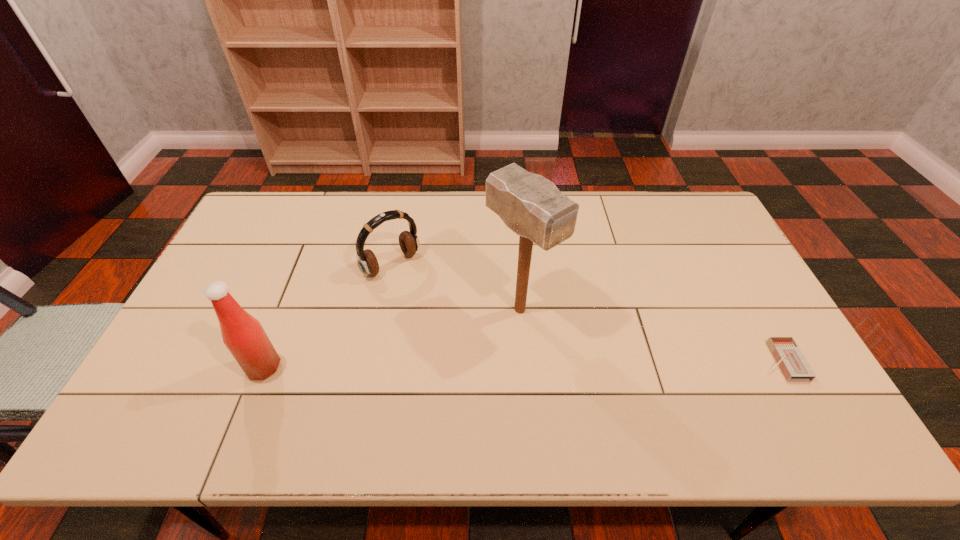
The image size is (960, 540). I want to click on the closest object relative to the third object from left to right, so click(x=367, y=262).

The image size is (960, 540). I want to click on blank space that satisfies the following two spatial constraints: 1. on the front side of the rightmost object; 2. on the striking surface of the headset, so click(372, 361).